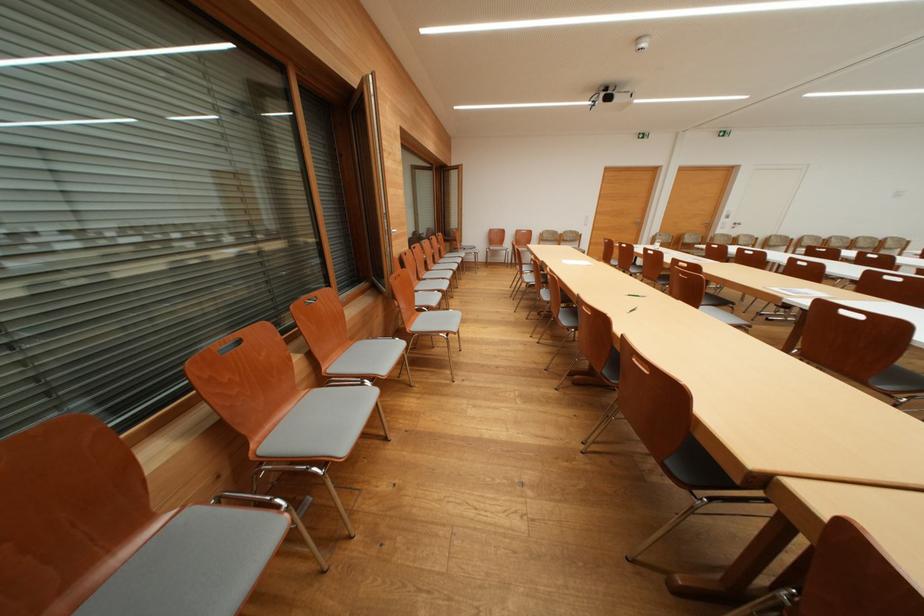
Where would you pull the silver door handle? Please return your answer as a coordinate pair (x, y).

(728, 220)